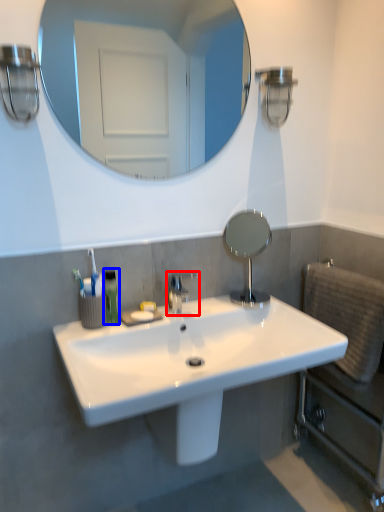
Question: Which object appears closest to the camera in this image, tap (highlighted by a red box) or mouthwash (highlighted by a blue box)?

Choices:
 (A) tap
 (B) mouthwash

Answer: (B)